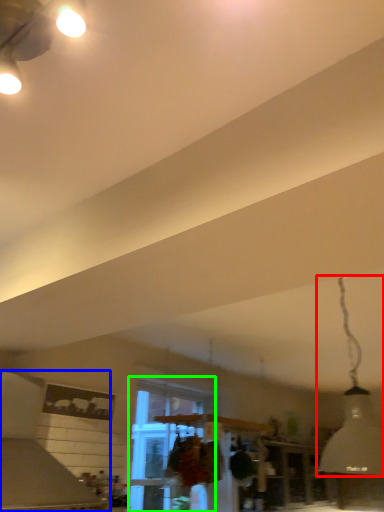
Question: Which is farther away from lamp (highlighted by a red box)? vent (highlighted by a blue box) or window (highlighted by a green box)?

Choices:
 (A) vent
 (B) window

Answer: (A)